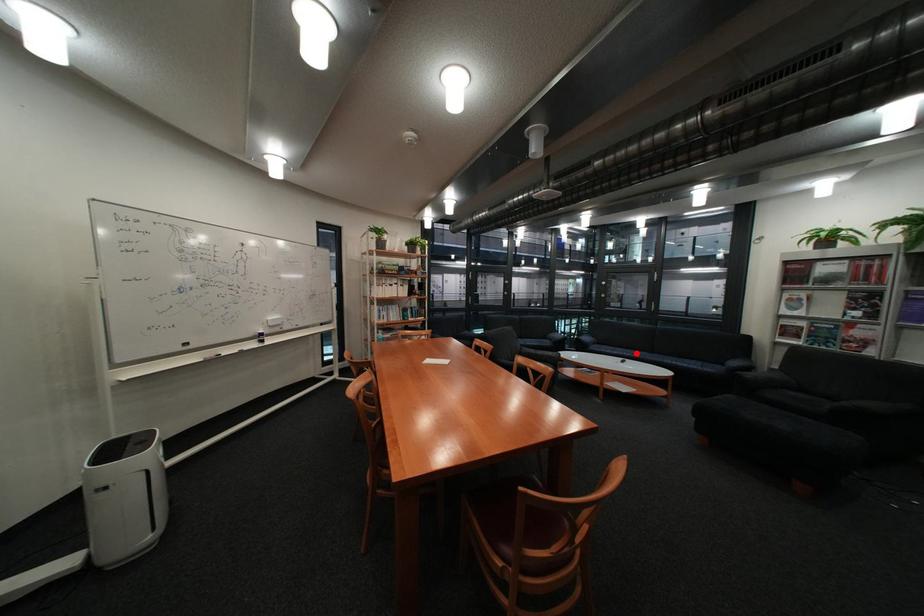
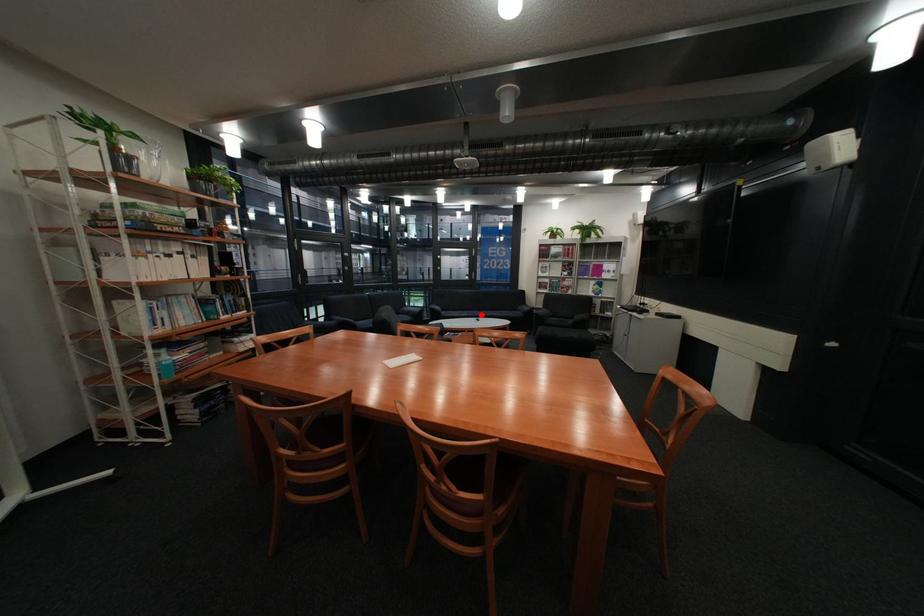
I am providing you with two images of the same scene from different viewpoints. A red point is marked on the first image and another point is marked on the second image. Is the red point in image1 aligned with the point shown in image2?

Yes